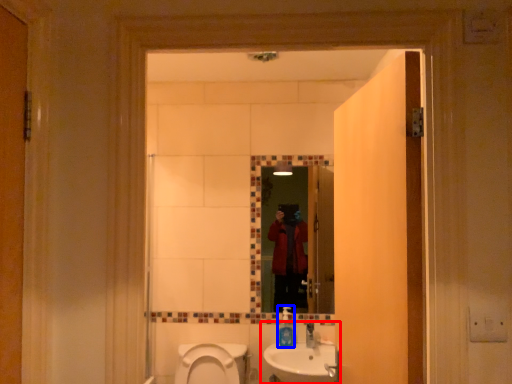
Question: Among these objects, which one is nearest to the camera, sink (highlighted by a red box) or soap dispenser (highlighted by a blue box)?

Choices:
 (A) sink
 (B) soap dispenser

Answer: (A)